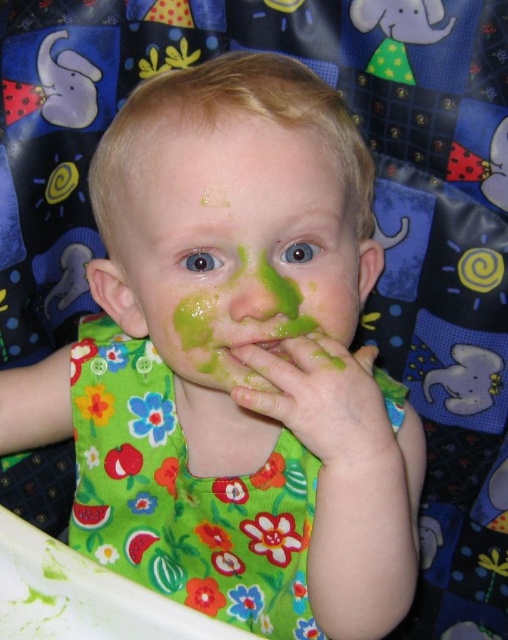
Is the position of green fabric bib at center less distant than that of green matte/solid mouth at center?

No, green fabric bib at center is behind green matte/solid mouth at center.

Describe the element at coordinates (183, 497) in the screenshot. I see `green fabric bib at center` at that location.

Where is `green fabric bib at center`? This screenshot has width=508, height=640. green fabric bib at center is located at coordinates (183, 497).

Is point (175, 200) farther from camera compared to point (361, 445)?

Yes, it is.

Based on the photo, who is positioned more to the right, green matte face at center or green matte hand at center?

green matte hand at center is more to the right.

Which is in front, point (249, 150) or point (316, 449)?

Point (249, 150) is in front.

Find the location of a particular element. This screenshot has height=640, width=508. green matte face at center is located at coordinates (237, 244).

Which is more to the left, green matte face at center or green matte/solid mouth at center?

green matte face at center

Can you confirm if green matte face at center is smaller than green matte/solid mouth at center?

No.

Measure the distance between point (129, 316) and camera.

Point (129, 316) and camera are 22.50 inches apart.

Where is `green matte face at center`? green matte face at center is located at coordinates (237, 244).